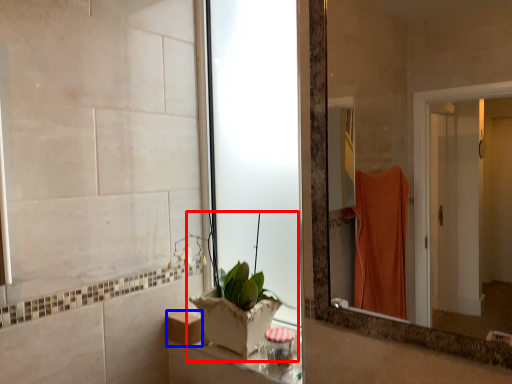
Question: Which object is closer to the camera taking this photo, houseplant (highlighted by a red box) or box (highlighted by a blue box)?

Choices:
 (A) houseplant
 (B) box

Answer: (A)